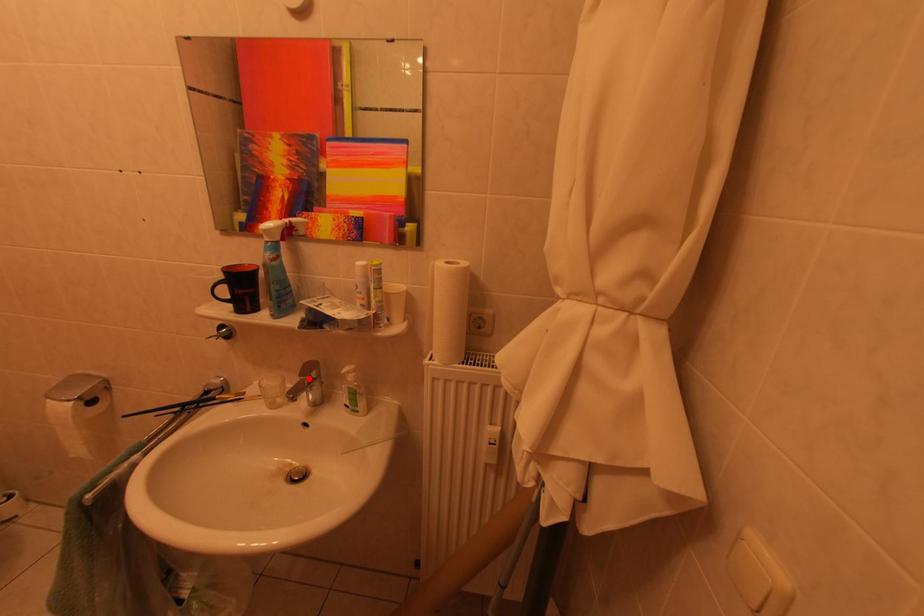
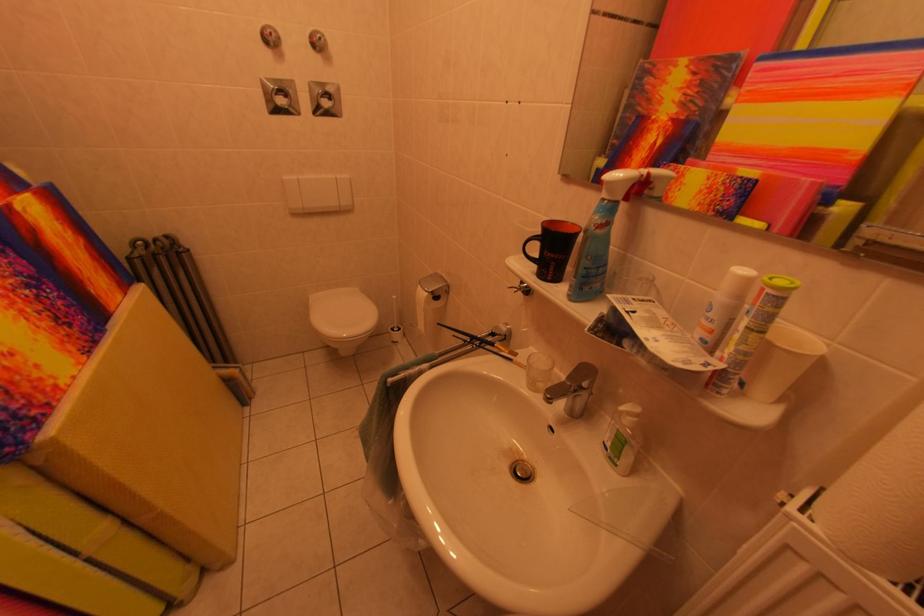
Question: I am providing you with two images of the same scene from different viewpoints. A red point is marked on the first image. Can you still see the location of the red point in image 2?

Choices:
 (A) Yes
 (B) No

Answer: (A)